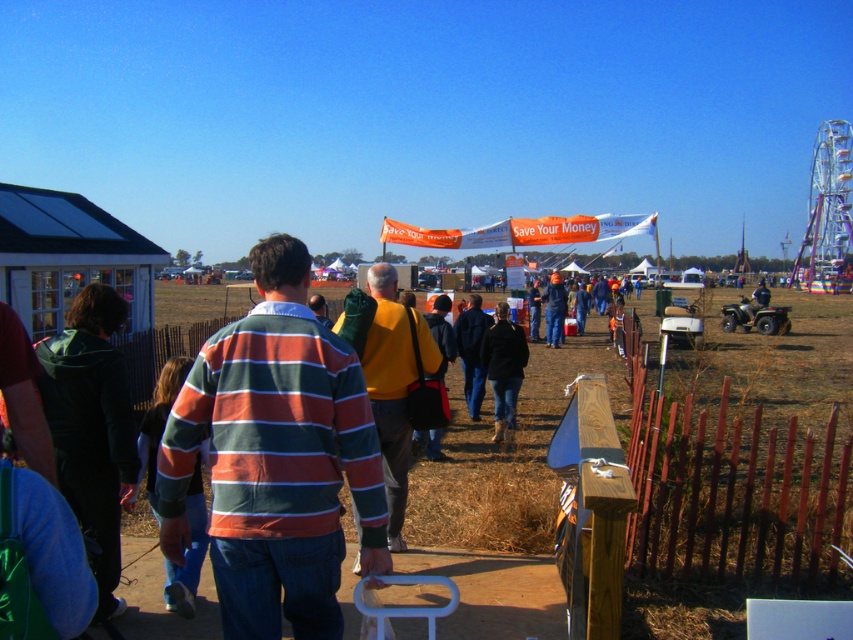
Question: Which object is closer to the camera taking this photo?

Choices:
 (A) yellow sweater at center
 (B) dark green hoodie at left
 (C) dark blue jeans at center
 (D) striped cotton shirt at center

Answer: (D)

Question: Is dark green hoodie at left positioned at the back of yellow sweater at center?

Choices:
 (A) yes
 (B) no

Answer: (B)

Question: Considering the real-world distances, which object is farthest from the dark blue jeans at center?

Choices:
 (A) orange striped sweater at center
 (B) striped cotton shirt at center
 (C) yellow sweater at center

Answer: (A)

Question: Does yellow sweater at center appear on the right side of orange striped sweater at center?

Choices:
 (A) no
 (B) yes

Answer: (A)

Question: Which object is farther from the camera taking this photo?

Choices:
 (A) orange striped sweater at center
 (B) yellow sweater at center

Answer: (A)

Question: Is dark green hoodie at left behind dark blue jeans at center?

Choices:
 (A) yes
 (B) no

Answer: (B)